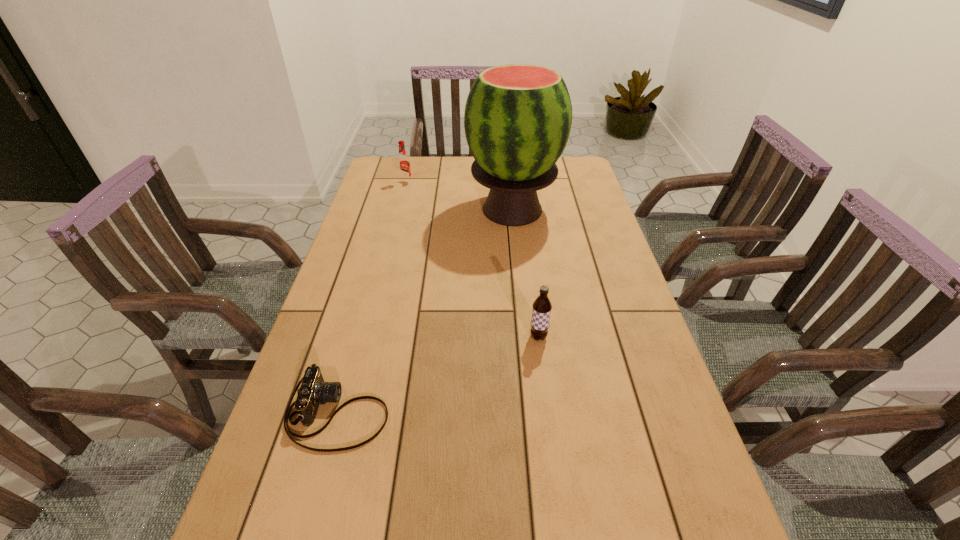
Image resolution: width=960 pixels, height=540 pixels. Identify the location of vacant space at the far left corner of the desktop. (413, 162).

This screenshot has height=540, width=960. Identify the location of free point between the nearer root beer and the second farthest object. (525, 273).

This screenshot has height=540, width=960. What are the coordinates of `free spot between the nearest object and the third farthest object` in the screenshot? It's located at (438, 375).

This screenshot has width=960, height=540. Find the location of `vacant space in between the nearer root beer and the farthest object`. vacant space in between the nearer root beer and the farthest object is located at coordinates tap(472, 260).

I want to click on empty space between the watermelon and the second nearest object, so click(x=525, y=273).

Find the location of `free area in between the nearer root beer and the tallest object`. free area in between the nearer root beer and the tallest object is located at coordinates (525, 273).

I want to click on unoccupied position between the shortest object and the second farthest object, so click(x=425, y=311).

Identify the location of vacant space that is in between the nearest object and the watermelon. (425, 311).

The image size is (960, 540). I want to click on free spot between the left root beer and the third nearest object, so click(x=460, y=197).

Identify the location of blank region between the second nearest object and the farther root beer. (472, 260).